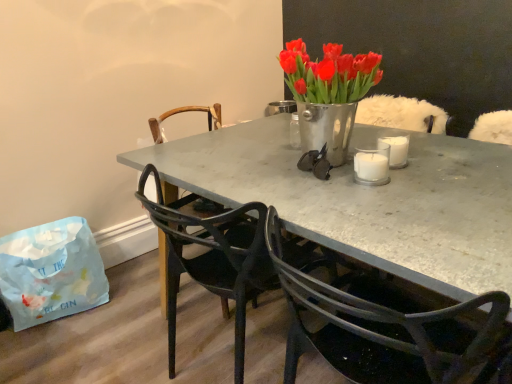
Where is `vacant area that is in front of white paper bag at lower left`? vacant area that is in front of white paper bag at lower left is located at coordinates (67, 351).